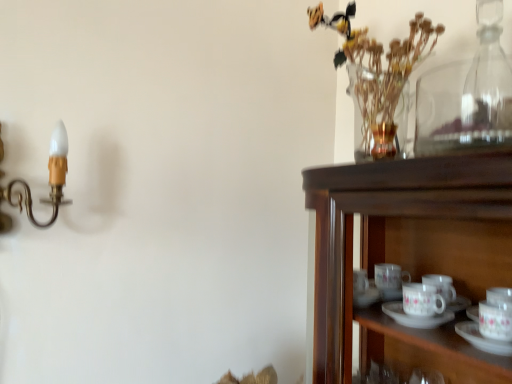
Question: Is there a large distance between clear glass vase at upper right and gold brass candle holder at left?

Choices:
 (A) no
 (B) yes

Answer: (A)

Question: From the image's perspective, is clear glass vase at upper right beneath gold brass candle holder at left?

Choices:
 (A) no
 (B) yes

Answer: (A)

Question: Is clear glass vase at upper right to the left of gold brass candle holder at left from the viewer's perspective?

Choices:
 (A) yes
 (B) no

Answer: (B)

Question: From a real-world perspective, is clear glass vase at upper right beneath gold brass candle holder at left?

Choices:
 (A) no
 (B) yes

Answer: (A)

Question: Is clear glass vase at upper right looking in the opposite direction of gold brass candle holder at left?

Choices:
 (A) yes
 (B) no

Answer: (B)

Question: Is clear glass vase at upper right wider than gold brass candle holder at left?

Choices:
 (A) no
 (B) yes

Answer: (B)

Question: Is gold brass candle holder at left further to camera compared to transparent glass bottle at upper right?

Choices:
 (A) yes
 (B) no

Answer: (B)

Question: Is gold brass candle holder at left taller than transparent glass bottle at upper right?

Choices:
 (A) no
 (B) yes

Answer: (A)

Question: Considering the relative sizes of gold brass candle holder at left and transparent glass bottle at upper right in the image provided, is gold brass candle holder at left bigger than transparent glass bottle at upper right?

Choices:
 (A) yes
 (B) no

Answer: (A)

Question: Is gold brass candle holder at left at the right side of transparent glass bottle at upper right?

Choices:
 (A) no
 (B) yes

Answer: (A)

Question: From a real-world perspective, does gold brass candle holder at left stand above transparent glass bottle at upper right?

Choices:
 (A) no
 (B) yes

Answer: (A)

Question: Does gold brass candle holder at left turn towards transparent glass bottle at upper right?

Choices:
 (A) no
 (B) yes

Answer: (A)

Question: From a real-world perspective, does clear glass vase at upper right sit lower than transparent glass bottle at upper right?

Choices:
 (A) yes
 (B) no

Answer: (B)